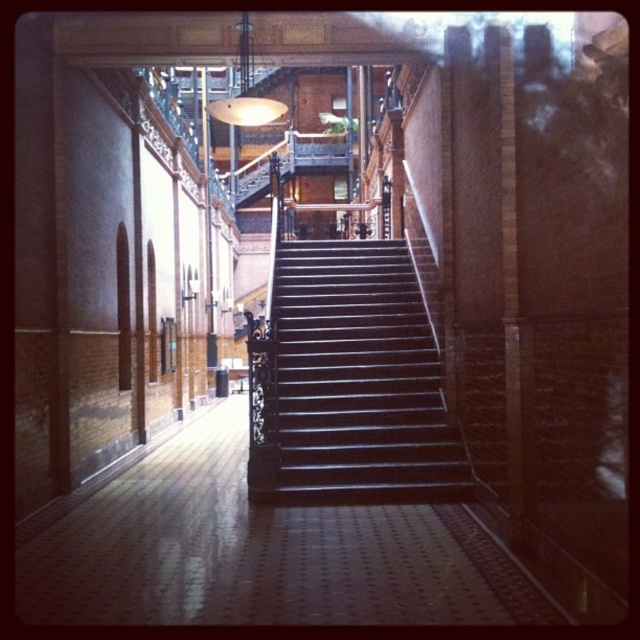
You are standing at the base of the staircase and want to reach the top. There are two points marked on the staircase, point (x=419, y=552) and point (x=413, y=362). Which point is closer to you as you look up the staircase?

Point (x=419, y=552) is closer to the camera than point (x=413, y=362), so it is the closer one as you look up the staircase.

You are a delivery person carrying a large box and need to move from the brown polished wood floor at center to the shiny dark wood stairs at center. Based on the height difference between them, will you need to step up or step down to reach the stairs?

The brown polished wood floor at center has a lesser height compared to shiny dark wood stairs at center, so you will need to step up to reach the stairs.

You are a delivery person carrying a large box and need to navigate through the historic building. You see the brown polished wood floor at center and the shiny dark wood stairs at center. Which direction should you move to avoid the stairs?

You should move to the left to avoid the shiny dark wood stairs at center since the brown polished wood floor at center is located to the left of them.